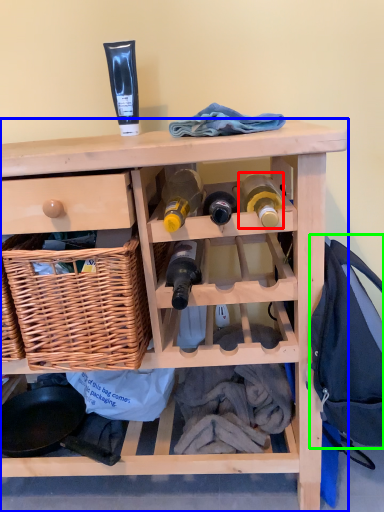
Question: Which is nearer to the bottle (highlighted by a red box)? furniture (highlighted by a blue box) or clothing (highlighted by a green box).

Choices:
 (A) furniture
 (B) clothing

Answer: (B)